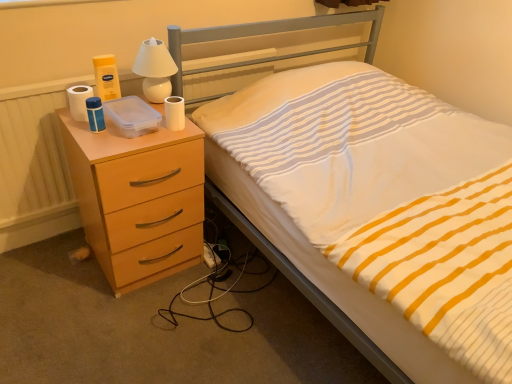
What is the approximate width of white matte toilet paper at upper right, which is counted as the 2th toilet paper, starting from the left?

white matte toilet paper at upper right, which is counted as the 2th toilet paper, starting from the left, is 2.73 inches in width.

In order to face peach wood chest of drawers at left, should I rotate leftwards or rightwards?

Turn left approximately 15.199 degrees to face it.

What do you see at coordinates (138, 199) in the screenshot? I see `peach wood chest of drawers at left` at bounding box center [138, 199].

The width and height of the screenshot is (512, 384). Describe the element at coordinates (155, 70) in the screenshot. I see `white glossy lamp at upper center` at that location.

Find the location of a particular element. The image size is (512, 384). white glossy lamp at upper center is located at coordinates (155, 70).

You are a GUI agent. You are given a task and a screenshot of the screen. Output one action in this format:
    pyautogui.click(x=<x>, y=<y>)
    Task: Click on the white striped fabric at center
    This screenshot has height=384, width=512.
    Given the screenshot: What is the action you would take?
    pyautogui.click(x=327, y=281)

Identify the location of the 1st toilet paper directly above the peach wood chest of drawers at left (from a real-world perspective). This screenshot has width=512, height=384. (174, 113).

From the image's perspective, is peach wood chest of drawers at left on top of white matte toilet paper at upper right, the 1th toilet paper from the right?

No, from the image's perspective, peach wood chest of drawers at left is not above white matte toilet paper at upper right, the 1th toilet paper from the right.

Is peach wood chest of drawers at left far from white matte toilet paper at upper right, which is counted as the 2th toilet paper, starting from the left?

No, peach wood chest of drawers at left is in close proximity to white matte toilet paper at upper right, which is counted as the 2th toilet paper, starting from the left.

Is peach wood chest of drawers at left at the left side of white matte toilet paper at upper right, the 1th toilet paper from the right?

Indeed, peach wood chest of drawers at left is positioned on the left side of white matte toilet paper at upper right, the 1th toilet paper from the right.

Looking at this image, would you say white striped fabric at center is a long distance from white matte toilet paper at upper right, the 1th toilet paper from the right?

white striped fabric at center is near white matte toilet paper at upper right, the 1th toilet paper from the right, not far away.

Is white striped fabric at center positioned beyond the bounds of white matte toilet paper at upper right, the 1th toilet paper from the right?

Yes, white striped fabric at center is not within white matte toilet paper at upper right, the 1th toilet paper from the right.

How different are the orientations of white striped fabric at center and white matte toilet paper at upper right, the 1th toilet paper from the right, in degrees?

The angle between the facing direction of white striped fabric at center and the facing direction of white matte toilet paper at upper right, the 1th toilet paper from the right, is 0.413 degrees.

Identify the location of bed located below the white matte toilet paper at upper right, which is counted as the 2th toilet paper, starting from the left (from the image's perspective). The image size is (512, 384). tap(327, 281).

Find the location of a particular element. The height and width of the screenshot is (384, 512). toilet paper located underneath the white matte toilet paper at left, acting as the 1th toilet paper starting from the left (from a real-world perspective) is located at coordinates pyautogui.click(x=174, y=113).

Is white matte toilet paper at upper right, which is counted as the 2th toilet paper, starting from the left, inside the boundaries of white matte toilet paper at left, which ranks as the second toilet paper in right-to-left order, or outside?

The correct answer is: outside.

Can you confirm if white matte toilet paper at upper right, the 1th toilet paper from the right, is bigger than white matte toilet paper at left, acting as the 1th toilet paper starting from the left?

No.

Is there a large distance between white matte toilet paper at upper right, the 1th toilet paper from the right, and white matte toilet paper at left, acting as the 1th toilet paper starting from the left?

No, white matte toilet paper at upper right, the 1th toilet paper from the right, is not far away from white matte toilet paper at left, acting as the 1th toilet paper starting from the left.

How different are the orientations of peach wood chest of drawers at left and white glossy lamp at upper center in degrees?

The angular difference between peach wood chest of drawers at left and white glossy lamp at upper center is 0.000667 degrees.

From the picture: Considering the sizes of objects peach wood chest of drawers at left and white glossy lamp at upper center in the image provided, who is taller, peach wood chest of drawers at left or white glossy lamp at upper center?

Standing taller between the two is peach wood chest of drawers at left.

Is point (195, 196) less distant than point (170, 92)?

Yes, point (195, 196) is closer to viewer.

Can you confirm if peach wood chest of drawers at left is bigger than white glossy lamp at upper center?

Yes, peach wood chest of drawers at left is bigger than white glossy lamp at upper center.

From the image's perspective, is white matte toilet paper at upper right, which is counted as the 2th toilet paper, starting from the left, located beneath peach wood chest of drawers at left?

Incorrect, from the image's perspective, white matte toilet paper at upper right, which is counted as the 2th toilet paper, starting from the left, is higher than peach wood chest of drawers at left.

Is white matte toilet paper at upper right, which is counted as the 2th toilet paper, starting from the left, shorter than peach wood chest of drawers at left?

Yes, white matte toilet paper at upper right, which is counted as the 2th toilet paper, starting from the left, is shorter than peach wood chest of drawers at left.

Is white matte toilet paper at upper right, the 1th toilet paper from the right, in front of or behind peach wood chest of drawers at left in the image?

white matte toilet paper at upper right, the 1th toilet paper from the right, is positioned farther from the viewer than peach wood chest of drawers at left.

Image resolution: width=512 pixels, height=384 pixels. Find the location of `the chest of drawers lying in front of the white matte toilet paper at upper right, which is counted as the 2th toilet paper, starting from the left`. the chest of drawers lying in front of the white matte toilet paper at upper right, which is counted as the 2th toilet paper, starting from the left is located at coordinates (138, 199).

Between white matte toilet paper at upper right, which is counted as the 2th toilet paper, starting from the left, and white striped fabric at center, which one appears on the right side from the viewer's perspective?

white striped fabric at center.

Between point (184, 112) and point (304, 247), which one is positioned in front?

Point (304, 247)

Is white matte toilet paper at upper right, which is counted as the 2th toilet paper, starting from the left, spatially inside white striped fabric at center, or outside of it?

white matte toilet paper at upper right, which is counted as the 2th toilet paper, starting from the left, is located beyond the bounds of white striped fabric at center.

Which of these two, white matte toilet paper at upper right, which is counted as the 2th toilet paper, starting from the left, or white striped fabric at center, stands taller?

white striped fabric at center.

From a real-world perspective, count 2nd toilet papers upward from the peach wood chest of drawers at left and point to it. Please provide its 2D coordinates.

[(79, 101)]

Considering the relative sizes of white matte toilet paper at left, which ranks as the second toilet paper in right-to-left order, and peach wood chest of drawers at left in the image provided, is white matte toilet paper at left, which ranks as the second toilet paper in right-to-left order, bigger than peach wood chest of drawers at left?

No, white matte toilet paper at left, which ranks as the second toilet paper in right-to-left order, is not bigger than peach wood chest of drawers at left.

Consider the image. Who is shorter, white matte toilet paper at left, which ranks as the second toilet paper in right-to-left order, or peach wood chest of drawers at left?

With less height is white matte toilet paper at left, which ranks as the second toilet paper in right-to-left order.

Where is `toilet paper that appears on the right of peach wood chest of drawers at left`? The width and height of the screenshot is (512, 384). toilet paper that appears on the right of peach wood chest of drawers at left is located at coordinates (174, 113).

From the white striped fabric at center, count the 1st toilet paper to the left and point to it. Please provide its 2D coordinates.

[(174, 113)]

Which object lies further to the anchor point white striped fabric at center, peach wood chest of drawers at left or white glossy lamp at upper center?

white glossy lamp at upper center is positioned further to the anchor white striped fabric at center.

Looking at the image, which one is located closer to white matte toilet paper at upper right, the 1th toilet paper from the right, white striped fabric at center or peach wood chest of drawers at left?

The object closer to white matte toilet paper at upper right, the 1th toilet paper from the right, is peach wood chest of drawers at left.

Based on their spatial positions, is white matte toilet paper at upper right, which is counted as the 2th toilet paper, starting from the left, or white glossy lamp at upper center closer to white striped fabric at center?

Based on the image, white matte toilet paper at upper right, which is counted as the 2th toilet paper, starting from the left, appears to be nearer to white striped fabric at center.

From the image, which object appears to be nearer to white glossy lamp at upper center, white matte toilet paper at left, which ranks as the second toilet paper in right-to-left order, or white matte toilet paper at upper right, the 1th toilet paper from the right?

The object closer to white glossy lamp at upper center is white matte toilet paper at upper right, the 1th toilet paper from the right.

From the image, which object appears to be nearer to peach wood chest of drawers at left, white matte toilet paper at left, which ranks as the second toilet paper in right-to-left order, or white matte toilet paper at upper right, the 1th toilet paper from the right?

white matte toilet paper at upper right, the 1th toilet paper from the right, is positioned closer to the anchor peach wood chest of drawers at left.

Based on their spatial positions, is white matte toilet paper at upper right, which is counted as the 2th toilet paper, starting from the left, or white striped fabric at center further from white matte toilet paper at left, which ranks as the second toilet paper in right-to-left order?

white striped fabric at center is positioned further to the anchor white matte toilet paper at left, which ranks as the second toilet paper in right-to-left order.

Estimate the real-world distances between objects in this image. Which object is further from peach wood chest of drawers at left, white striped fabric at center or white matte toilet paper at left, which ranks as the second toilet paper in right-to-left order?

white striped fabric at center is further to peach wood chest of drawers at left.

Looking at the image, which one is located further to white matte toilet paper at left, acting as the 1th toilet paper starting from the left, peach wood chest of drawers at left or white matte toilet paper at upper right, the 1th toilet paper from the right?

peach wood chest of drawers at left is further to white matte toilet paper at left, acting as the 1th toilet paper starting from the left.

Where is `bedside lamp between white matte toilet paper at left, which ranks as the second toilet paper in right-to-left order, and white matte toilet paper at upper right, which is counted as the 2th toilet paper, starting from the left, in the horizontal direction`? The height and width of the screenshot is (384, 512). bedside lamp between white matte toilet paper at left, which ranks as the second toilet paper in right-to-left order, and white matte toilet paper at upper right, which is counted as the 2th toilet paper, starting from the left, in the horizontal direction is located at coordinates (155, 70).

Identify the location of toilet paper between white matte toilet paper at left, which ranks as the second toilet paper in right-to-left order, and peach wood chest of drawers at left vertically. (174, 113).

This screenshot has height=384, width=512. Find the location of `bedside lamp between peach wood chest of drawers at left and white striped fabric at center`. bedside lamp between peach wood chest of drawers at left and white striped fabric at center is located at coordinates (155, 70).

Where is `chest of drawers between white matte toilet paper at left, acting as the 1th toilet paper starting from the left, and white striped fabric at center, in the horizontal direction`? chest of drawers between white matte toilet paper at left, acting as the 1th toilet paper starting from the left, and white striped fabric at center, in the horizontal direction is located at coordinates (138, 199).